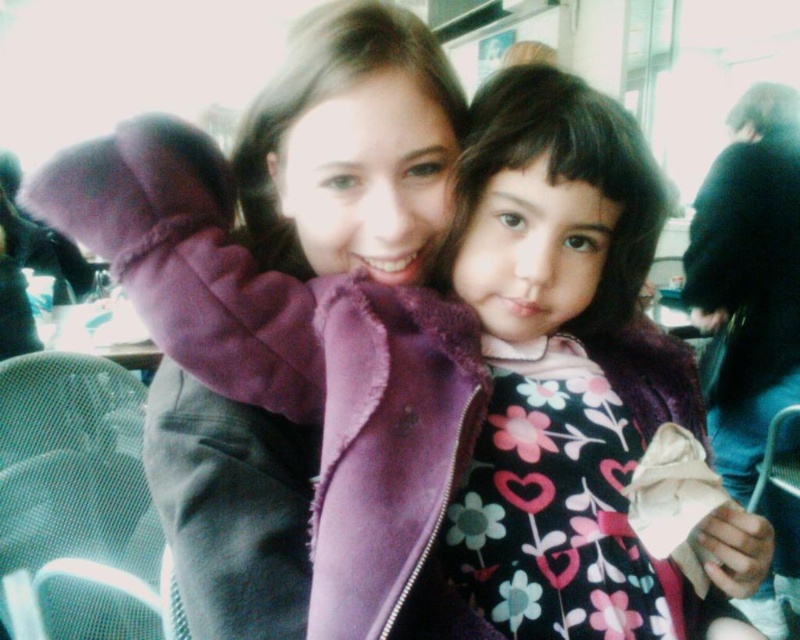
Question: Does floral dress at center appear on the right side of purple fleece jacket at upper center?

Choices:
 (A) no
 (B) yes

Answer: (B)

Question: Which point appears closest to the camera in this image?

Choices:
 (A) (440, 346)
 (B) (580, 438)

Answer: (A)

Question: Is the position of floral dress at center less distant than that of purple fleece jacket at upper center?

Choices:
 (A) no
 (B) yes

Answer: (A)

Question: Can you confirm if floral dress at center is thinner than purple fleece jacket at upper center?

Choices:
 (A) yes
 (B) no

Answer: (A)

Question: Which object is farther from the camera taking this photo?

Choices:
 (A) purple fleece jacket at upper center
 (B) floral dress at center

Answer: (B)

Question: Which point is closer to the camera?

Choices:
 (A) floral dress at center
 (B) purple fleece jacket at upper center

Answer: (B)